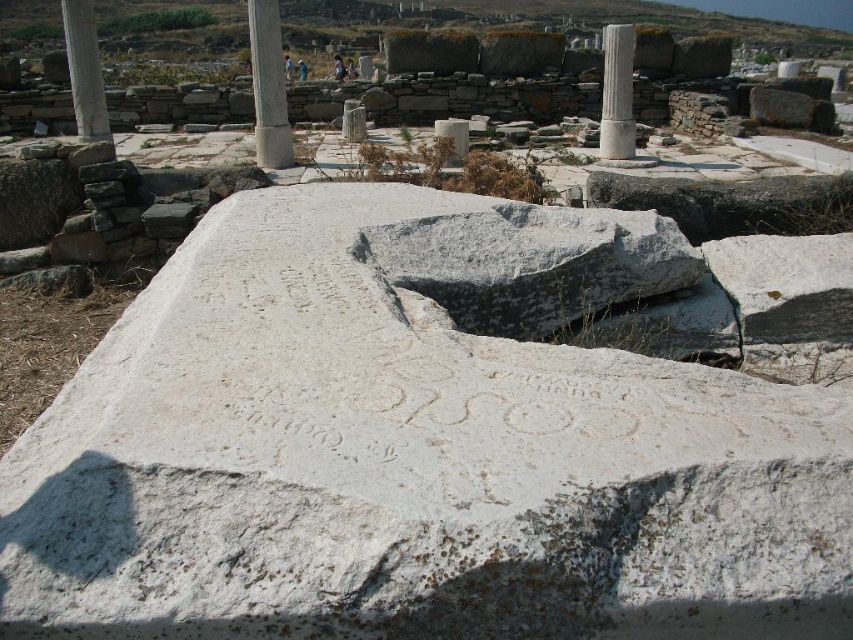
Does white stone column at center appear on the left side of white stone column at upper left?

Incorrect, white stone column at center is not on the left side of white stone column at upper left.

Is the position of white stone column at center less distant than that of white stone column at upper left?

Yes, white stone column at center is in front of white stone column at upper left.

What do you see at coordinates (268, 86) in the screenshot? The image size is (853, 640). I see `white stone column at center` at bounding box center [268, 86].

Locate an element on the screen. The width and height of the screenshot is (853, 640). white stone column at center is located at coordinates (268, 86).

Between white stone at center and white stone column at upper left, which one has more height?

white stone column at upper left is taller.

Is white stone at center further to the viewer compared to white stone column at upper left?

No.

Between point (585, 528) and point (90, 58), which one is positioned behind?

The point (90, 58) is more distant.

Locate an element on the screen. This screenshot has width=853, height=640. white stone at center is located at coordinates (418, 444).

Where is `white stone at center`? The image size is (853, 640). white stone at center is located at coordinates (418, 444).

Can you confirm if white stone at center is positioned to the left of white marble column at upper center?

Yes, white stone at center is to the left of white marble column at upper center.

The image size is (853, 640). I want to click on white stone at center, so click(418, 444).

This screenshot has height=640, width=853. Find the location of `white stone at center`. white stone at center is located at coordinates (418, 444).